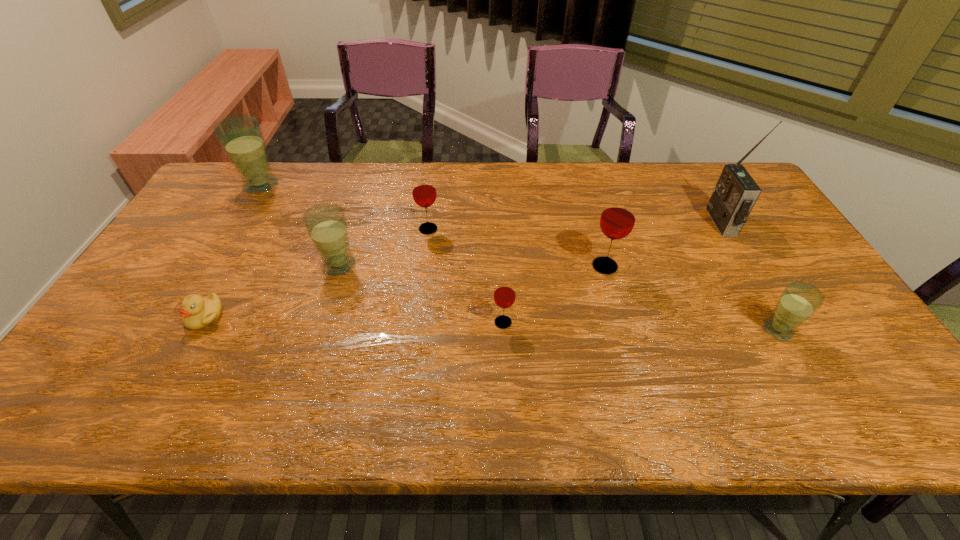
Locate an element on the screen. Image resolution: width=960 pixels, height=540 pixels. blue glass identified as the second closest to the third glass from right to left is located at coordinates (799, 300).

Choose which blue glass is the nearest neighbor to the farthest blue glass. Please provide its 2D coordinates. Your answer should be formatted as a tuple, i.e. [(x, y)], where the tuple contains the x and y coordinates of a point satisfying the conditions above.

[(326, 224)]

At what (x,y) coordinates should I click in order to perform the action: click on free space that satisfies the following two spatial constraints: 1. on the front side of the fourth glass from right to left; 2. on the left side of the fourth glass from left to right. Please return your answer as a coordinate pair (x, y). Looking at the image, I should click on (417, 322).

This screenshot has width=960, height=540. What are the coordinates of `free region that satisfies the following two spatial constraints: 1. on the front side of the rightmost glass; 2. on the left side of the nearest red glass` in the screenshot? It's located at (503, 330).

You are a GUI agent. You are given a task and a screenshot of the screen. Output one action in this format:
    pyautogui.click(x=<x>, y=<y>)
    Task: Click on the vacant space that satisfies the following two spatial constraints: 1. on the front side of the nearest blue glass; 2. on the right side of the farthest glass
    The height and width of the screenshot is (540, 960).
    Given the screenshot: What is the action you would take?
    pyautogui.click(x=175, y=330)